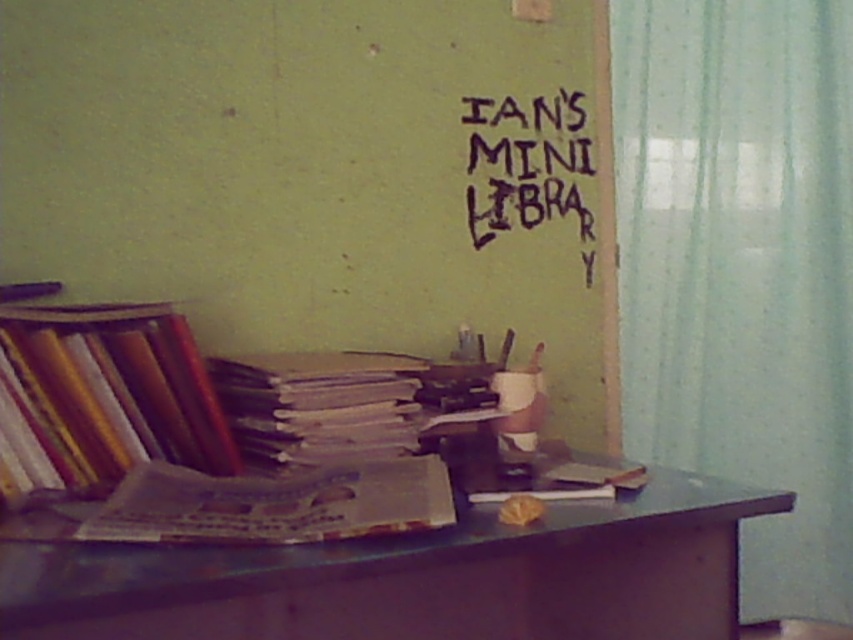
Question: Which of the following is the farthest from the observer?

Choices:
 (A) matte paper book at center
 (B) black marker writing at upper center

Answer: (B)

Question: Is the position of translucent fabric curtain at right less distant than that of smooth brown table at center?

Choices:
 (A) no
 (B) yes

Answer: (A)

Question: Can you confirm if smooth brown table at center is positioned above matte paper books at left?

Choices:
 (A) no
 (B) yes

Answer: (A)

Question: Which point is farther to the camera?

Choices:
 (A) (318, 513)
 (B) (621, 72)
 (C) (251, 456)
 (D) (440, 621)

Answer: (B)

Question: Among these objects, which one is farthest from the camera?

Choices:
 (A) black marker writing at upper center
 (B) matte paper books at left
 (C) white paper stack at center
 (D) matte paper book at center

Answer: (A)

Question: In this image, where is smooth brown table at center located relative to matte paper books at left?

Choices:
 (A) above
 (B) below

Answer: (B)